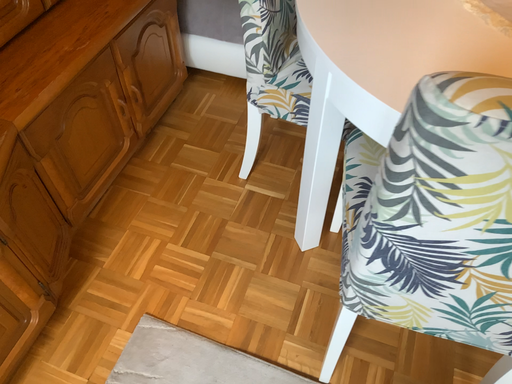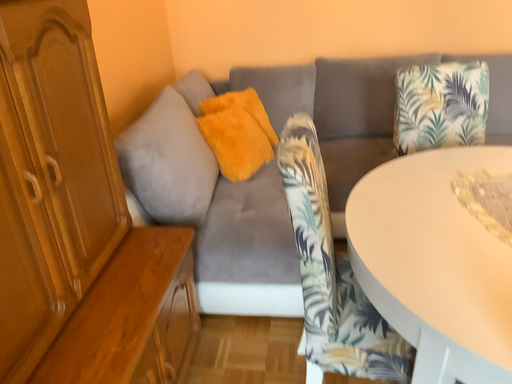
Question: How did the camera likely rotate when shooting the video?

Choices:
 (A) rotated downward
 (B) rotated upward

Answer: (B)